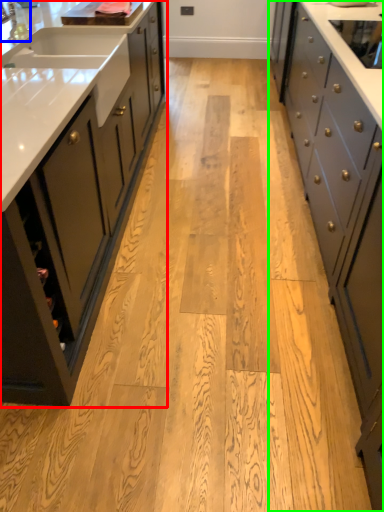
Question: Considering the real-world distances, which object is closest to cabinetry (highlighted by a red box)? faucet (highlighted by a blue box) or cabinetry (highlighted by a green box).

Choices:
 (A) faucet
 (B) cabinetry

Answer: (A)